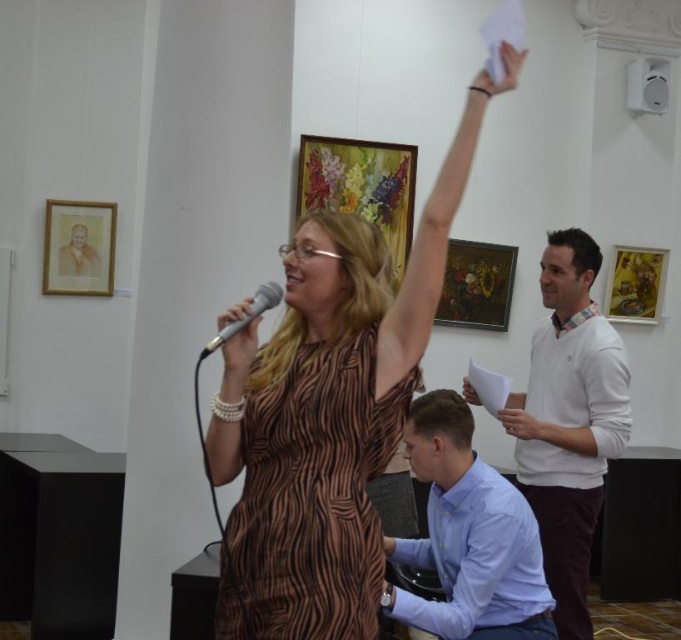
Question: Which object appears closest to the camera in this image?

Choices:
 (A) wooden oil painting at center
 (B) wooden framed floral painting at upper center

Answer: (B)

Question: Is wooden framed floral painting at upper center smaller than gold-framed painting at upper right?

Choices:
 (A) no
 (B) yes

Answer: (A)

Question: Estimate the real-world distances between objects in this image. Which object is farther from the silver metallic microphone at center?

Choices:
 (A) matte gold picture frame at upper left
 (B) wooden framed floral painting at upper center
 (C) white plastic speaker at upper right

Answer: (C)

Question: Is wooden framed floral painting at upper center thinner than matte gold picture frame at upper left?

Choices:
 (A) no
 (B) yes

Answer: (A)

Question: Can you confirm if gold-framed painting at upper right is positioned below matte black microphone at center?

Choices:
 (A) no
 (B) yes

Answer: (A)

Question: Estimate the real-world distances between objects in this image. Which object is closer to the brown textured dress at center?

Choices:
 (A) white cotton shirt at upper right
 (B) silver metallic microphone at center
 (C) gold-framed painting at upper right
 (D) wooden oil painting at center

Answer: (B)